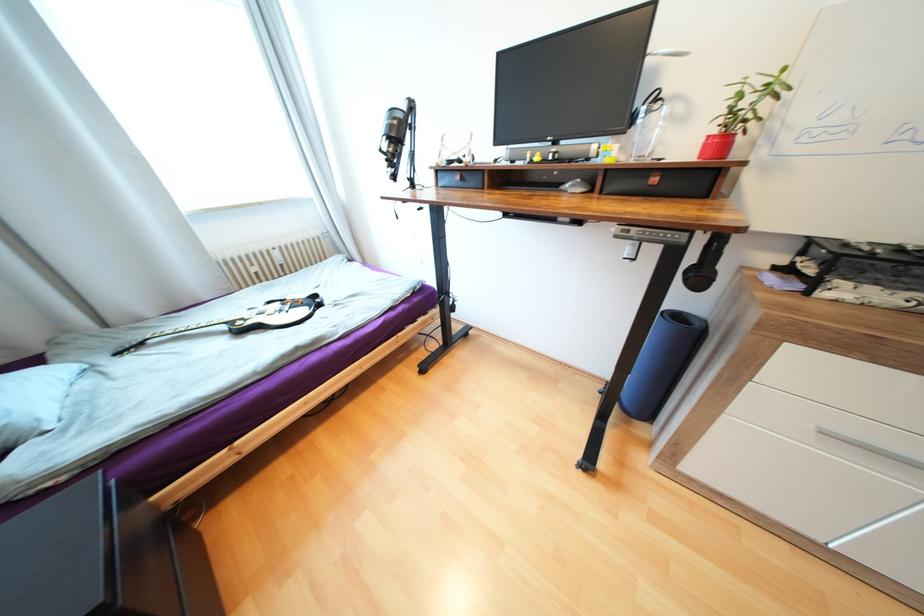
Find where to slid the computer mouse. Please return your answer as a coordinate pair (x, y).

(576, 185)